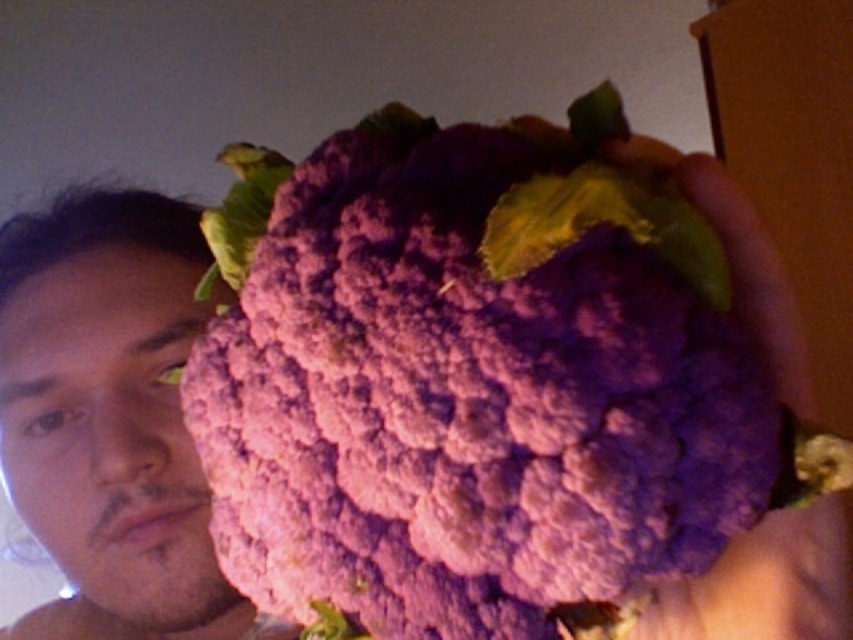
Question: Which point is farther to the camera?

Choices:
 (A) (802, 376)
 (B) (155, 497)
 (C) (254, 413)

Answer: (B)

Question: Which is farther from the purple fabric hand at center?

Choices:
 (A) purple matte broccoli at center
 (B) smooth skin face at left

Answer: (B)

Question: Considering the relative positions of purple matte broccoli at center and purple fabric hand at center in the image provided, where is purple matte broccoli at center located with respect to purple fabric hand at center?

Choices:
 (A) above
 (B) below

Answer: (A)

Question: Can you confirm if purple matte broccoli at center is positioned below smooth skin face at left?

Choices:
 (A) no
 (B) yes

Answer: (A)

Question: Estimate the real-world distances between objects in this image. Which object is farther from the purple fabric hand at center?

Choices:
 (A) smooth skin face at left
 (B) purple matte broccoli at center

Answer: (A)

Question: Does purple matte broccoli at center have a lesser width compared to smooth skin face at left?

Choices:
 (A) no
 (B) yes

Answer: (A)